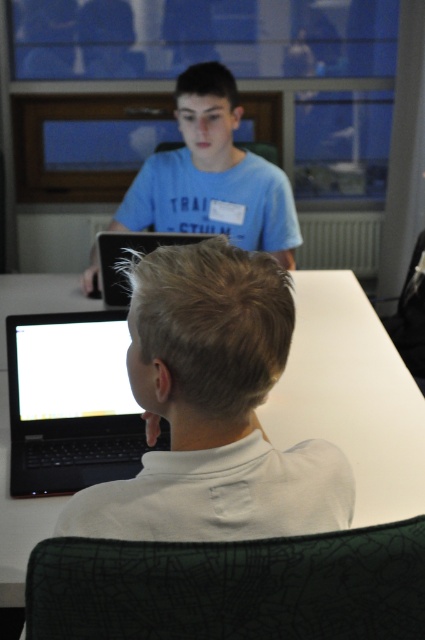
Looking at this image, can you confirm if white glossy laptop at lower left is positioned above black matte laptop at center?

Incorrect, white glossy laptop at lower left is not positioned above black matte laptop at center.

Is point (127, 337) in front of point (101, 252)?

Yes, point (127, 337) is in front of point (101, 252).

Where is `white glossy laptop at lower left`? The width and height of the screenshot is (425, 640). white glossy laptop at lower left is located at coordinates (73, 369).

Identify the location of white glossy table at center. (351, 396).

The image size is (425, 640). What do you see at coordinates (351, 396) in the screenshot? I see `white glossy table at center` at bounding box center [351, 396].

In order to click on white glossy table at center in this screenshot , I will do 351,396.

Does blue cotton shirt at upper center appear on the left side of black matte laptop at center?

Incorrect, blue cotton shirt at upper center is not on the left side of black matte laptop at center.

Is blue cotton shirt at upper center shorter than black matte laptop at center?

In fact, blue cotton shirt at upper center may be taller than black matte laptop at center.

This screenshot has width=425, height=640. I want to click on blue cotton shirt at upper center, so click(212, 176).

You are a GUI agent. You are given a task and a screenshot of the screen. Output one action in this format:
    pyautogui.click(x=<x>, y=<y>)
    Task: Click on the blue cotton shirt at upper center
    This screenshot has width=425, height=640.
    Given the screenshot: What is the action you would take?
    pyautogui.click(x=212, y=176)